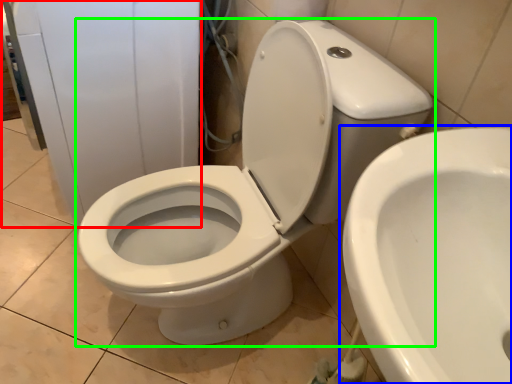
Question: Based on their relative distances, which object is farther from porcelain (highlighted by a red box)? Choose from toilet (highlighted by a blue box) and toilet (highlighted by a green box).

Choices:
 (A) toilet
 (B) toilet

Answer: (A)